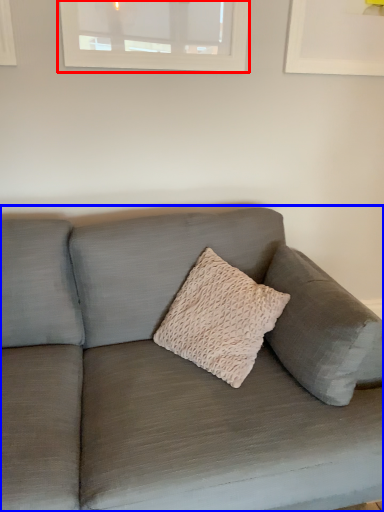
Question: Which of the following is the closest to the observer, window (highlighted by a red box) or studio couch (highlighted by a blue box)?

Choices:
 (A) window
 (B) studio couch

Answer: (B)